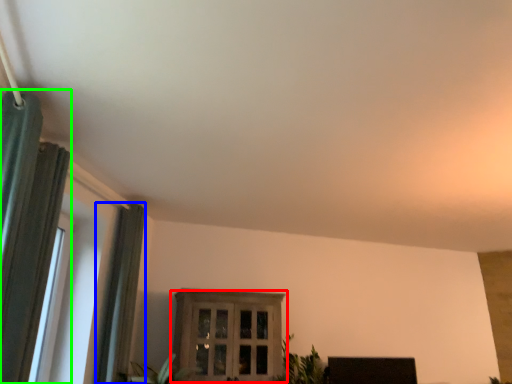
Question: Estimate the real-world distances between objects in this image. Which object is closer to window (highlighted by a red box), curtain (highlighted by a blue box) or curtain (highlighted by a green box)?

Choices:
 (A) curtain
 (B) curtain

Answer: (A)